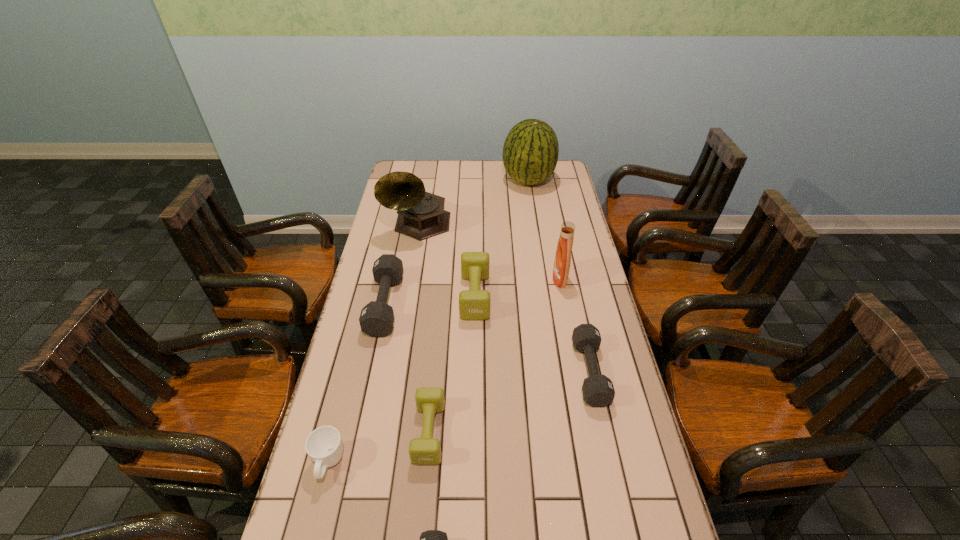
The height and width of the screenshot is (540, 960). Find the location of `object that is at the far right corner`. object that is at the far right corner is located at coordinates (530, 153).

Image resolution: width=960 pixels, height=540 pixels. What are the coordinates of `vacant space at the far edge of the desktop` in the screenshot? It's located at (461, 160).

This screenshot has height=540, width=960. Find the location of `vacant space at the left edge of the desktop`. vacant space at the left edge of the desktop is located at coordinates (388, 402).

In the image, there is a desktop. Where is `vacant region at the right edge`? This screenshot has width=960, height=540. vacant region at the right edge is located at coordinates (574, 351).

At what (x,y) coordinates should I click in order to perform the action: click on free area in between the detergent and the bigger olive dumbbell. Please return your answer as a coordinate pair (x, y). Looking at the image, I should click on (517, 287).

I want to click on vacant point located between the detergent and the rightmost gray dumbbell, so click(575, 326).

Find the location of `free point between the biggest gray dumbbell and the green watermelon`. free point between the biggest gray dumbbell and the green watermelon is located at coordinates (457, 242).

Locate an element on the screen. The width and height of the screenshot is (960, 540). unoccupied area between the fourth object from right to left and the left olive dumbbell is located at coordinates click(452, 364).

Find the location of a particular element. This screenshot has height=540, width=960. the seventh closest object to the green watermelon is located at coordinates (324, 445).

This screenshot has width=960, height=540. Identify the location of the second closest object relative to the detergent. (474, 304).